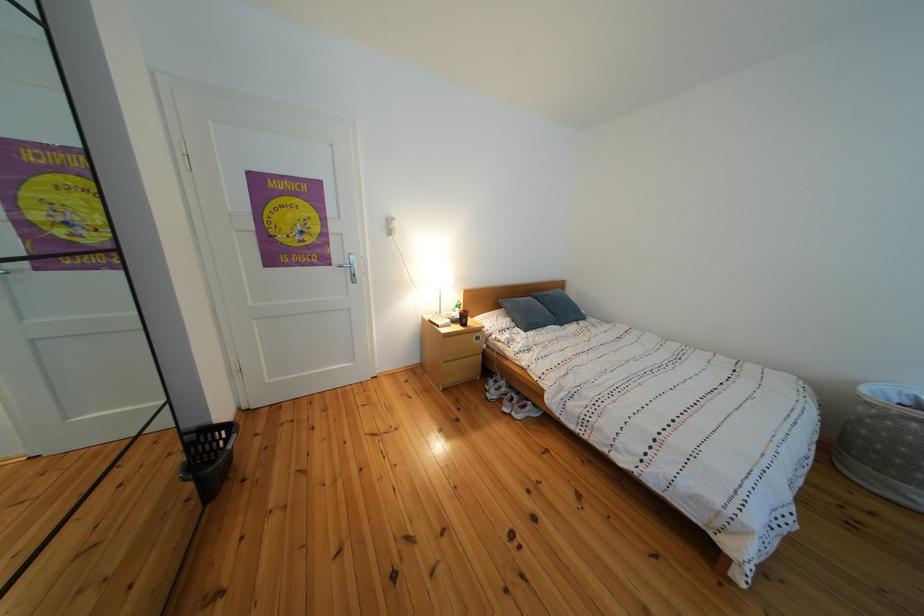
The image size is (924, 616). Find the location of `silver door handle`. silver door handle is located at coordinates (347, 267).